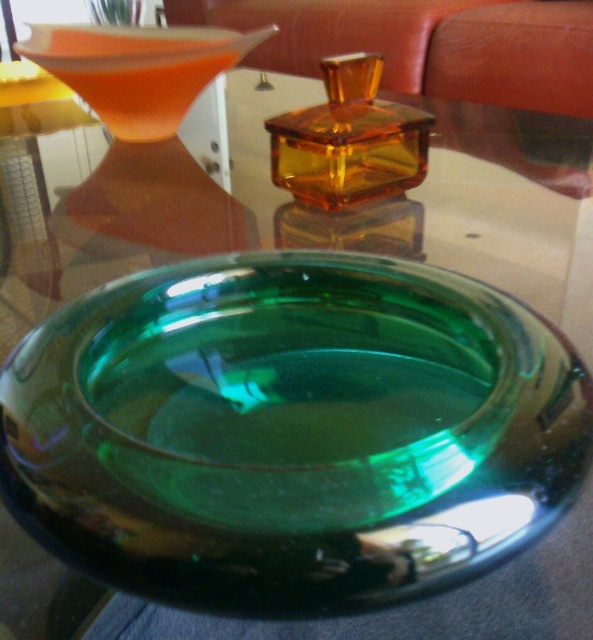
Can you confirm if translucent amber glass at upper left is bigger than amber glass perfume at center?

Indeed, translucent amber glass at upper left has a larger size compared to amber glass perfume at center.

Is point (132, 212) closer to viewer compared to point (397, 144)?

Yes, point (132, 212) is closer to viewer.

Identify the location of translucent amber glass at upper left. (148, 131).